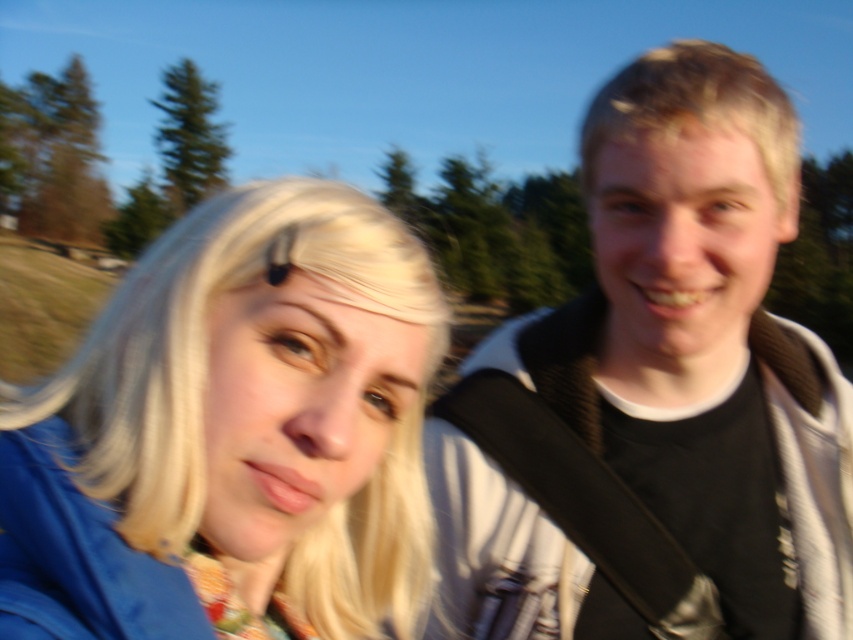
Can you confirm if black cotton shirt at right is smaller than blonde hair at left?

Incorrect, black cotton shirt at right is not smaller in size than blonde hair at left.

Is black cotton shirt at right below blonde hair at left?

No, black cotton shirt at right is not below blonde hair at left.

Image resolution: width=853 pixels, height=640 pixels. Describe the element at coordinates (656, 396) in the screenshot. I see `black cotton shirt at right` at that location.

Where is `black cotton shirt at right`? This screenshot has height=640, width=853. black cotton shirt at right is located at coordinates (656, 396).